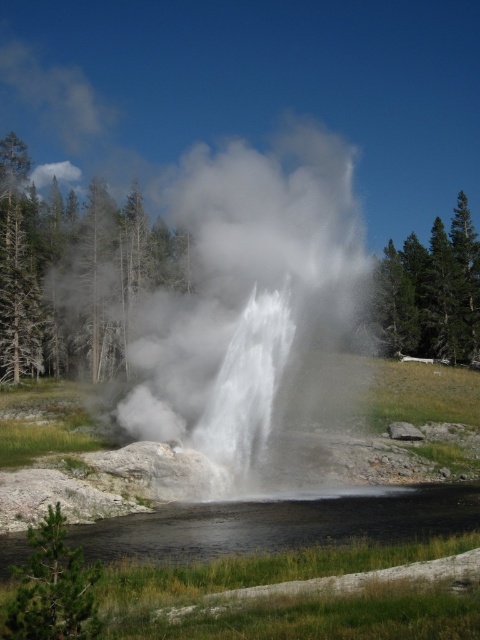
You are a park ranger standing at the edge of the geyser area. You notice a point marked at coordinates (247, 304) in the image. What is located at that point?

The point at coordinates (247, 304) marks white vapor at center.

You are standing at the observation deck near the geyser. You notice a point marked at coordinates point (228, 209). If you want to place a safety barrier 30 meters away from the geyser to ensure visitor safety, is the marked point within the safe distance?

The distance of point (228, 209) from viewer is 29.74 meters, so the marked point is within the safe distance of 30 meters and the barrier should be placed beyond this point.

Based on the photo, you are a photographer trying to capture the geyser eruption. You notice the white vapor at center and the black glossy water at center. Which object should you focus on first if you want to capture the base of the geyser before the mist obscures it?

You should focus on the black glossy water at center first because it is located below the white vapor at center and represents the base of the geyser. The white vapor at center is above it and may obscure the view later.